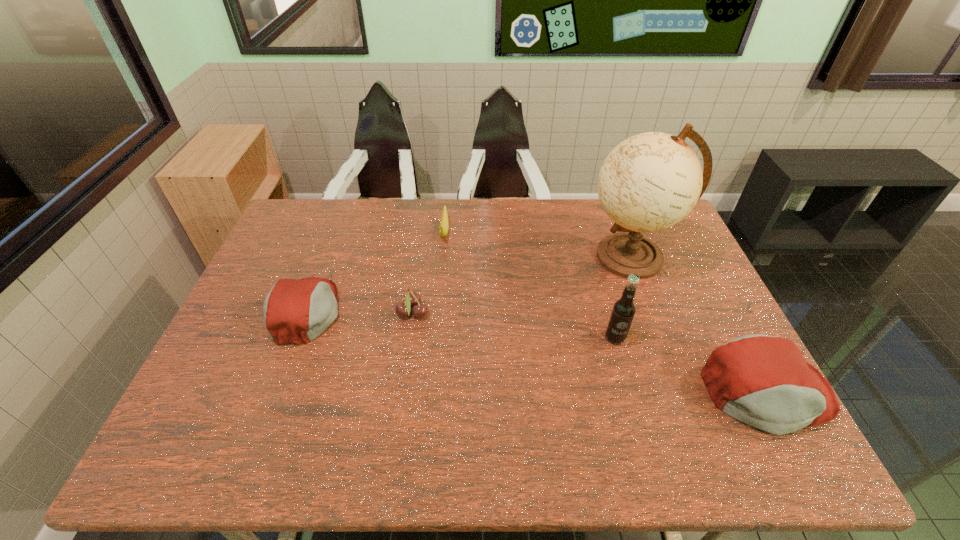
Select which object appears as the second closest to the root beer. Please provide its 2D coordinates. Your answer should be formatted as a tuple, i.e. [(x, y)], where the tuple contains the x and y coordinates of a point satisfying the conditions above.

[(651, 181)]

Locate an element on the screen. The image size is (960, 540). free space in the image that satisfies the following two spatial constraints: 1. at the stem of the banana; 2. on the leaves of the cherry is located at coordinates [x=437, y=313].

Locate an element on the screen. The width and height of the screenshot is (960, 540). free location that satisfies the following two spatial constraints: 1. on the surface of the globe; 2. on the label of the root beer is located at coordinates (661, 338).